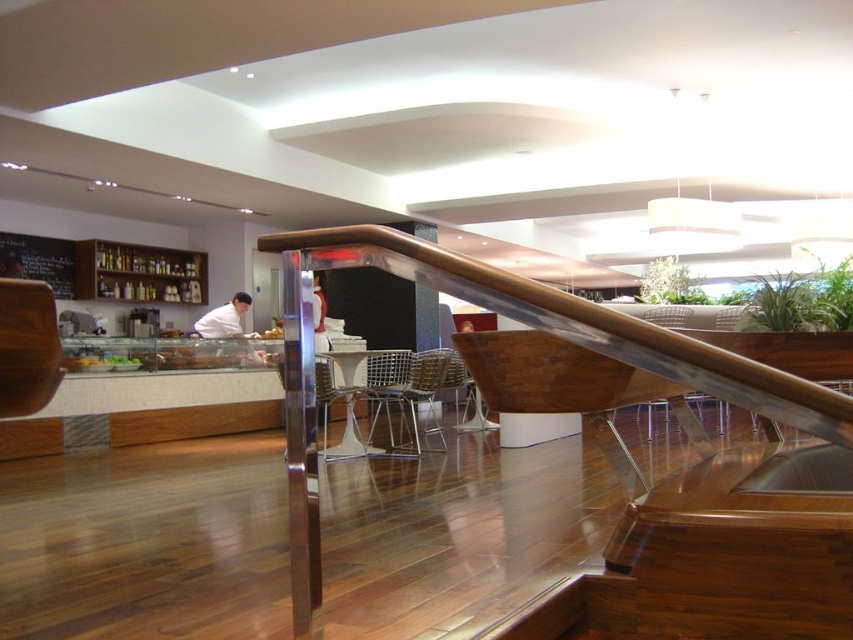
Who is taller, polished stainless steel handrail at center or wooden pillar at center?

Standing taller between the two is wooden pillar at center.

Identify the location of polished stainless steel handrail at center. (693, 467).

Is point (288, 424) in front of point (438, 333)?

Yes, it is.

The height and width of the screenshot is (640, 853). Identify the location of polished stainless steel handrail at center. (693, 467).

Is metallic mesh chair at center bigger than metallic silver chair at center?

Yes.

Is the position of metallic mesh chair at center less distant than that of metallic silver chair at center?

No, it is behind metallic silver chair at center.

Describe the element at coordinates (404, 390) in the screenshot. I see `metallic mesh chair at center` at that location.

Where is `metallic mesh chair at center`? The width and height of the screenshot is (853, 640). metallic mesh chair at center is located at coordinates click(x=404, y=390).

Based on the photo, who is taller, metallic silver chair at center or wooden pillar at center?

wooden pillar at center is taller.

Does metallic silver chair at center appear on the left side of wooden pillar at center?

Correct, you'll find metallic silver chair at center to the left of wooden pillar at center.

What do you see at coordinates (347, 406) in the screenshot?
I see `metallic silver chair at center` at bounding box center [347, 406].

Locate an element on the screen. This screenshot has height=640, width=853. metallic silver chair at center is located at coordinates (347, 406).